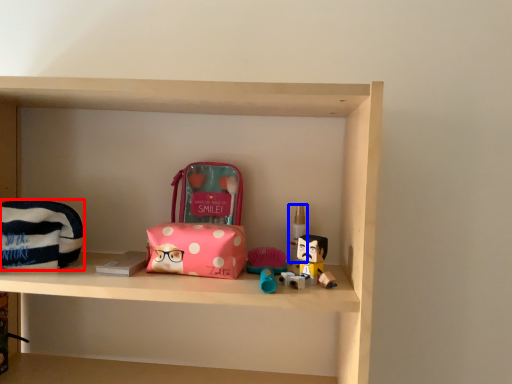
Question: Which of the following is the farthest to the observer, pouch (highlighted by a red box) or toiletry (highlighted by a blue box)?

Choices:
 (A) pouch
 (B) toiletry

Answer: (B)